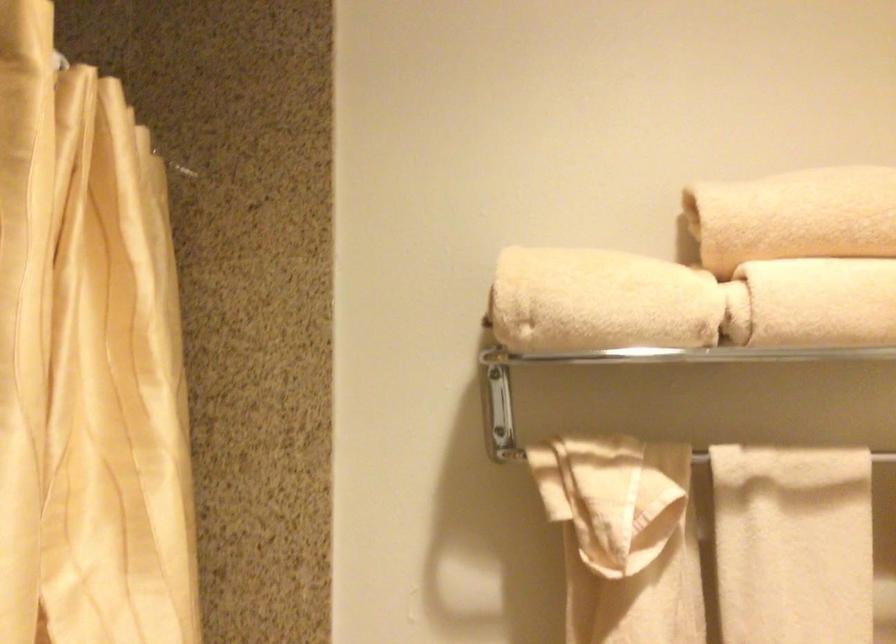
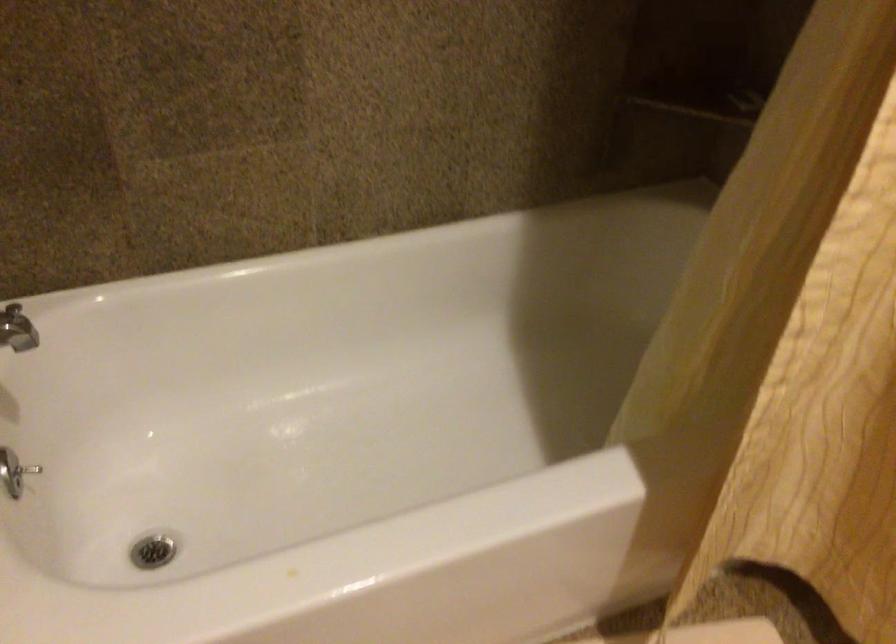
First-person continuous shooting, in which direction is the camera rotating?

The camera rotated toward left-down.